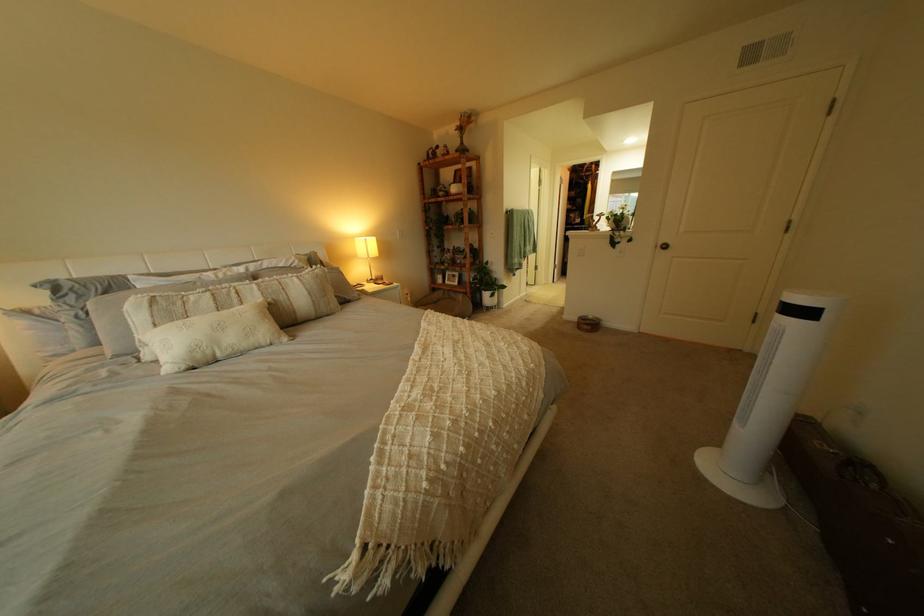
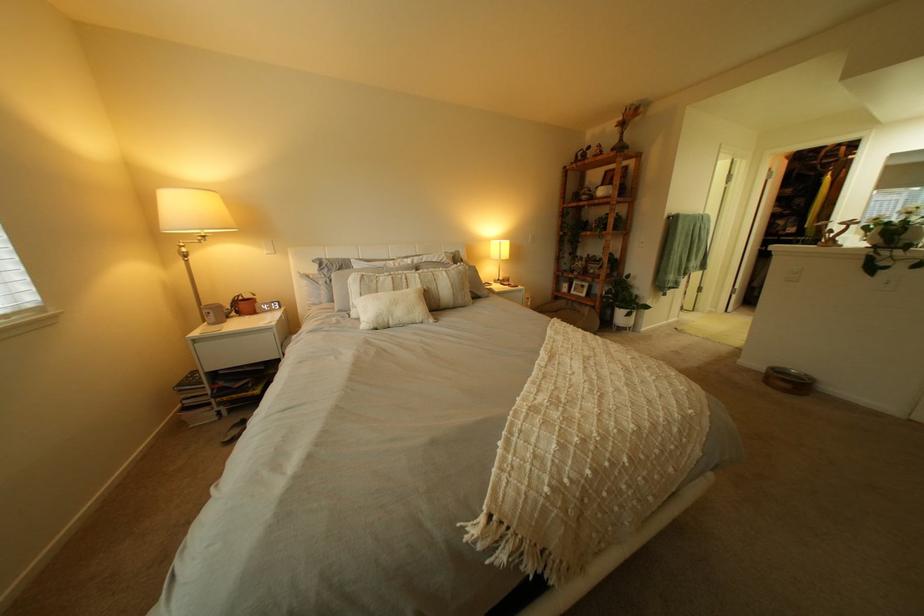
Find the pixel in the second image that matches (x=416, y=387) in the first image.

(541, 387)